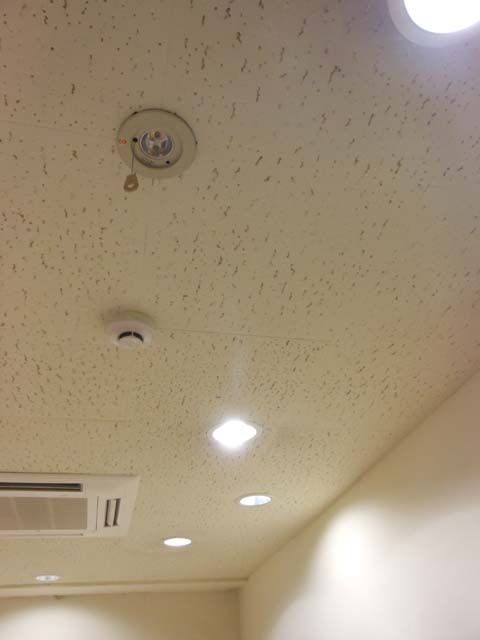
Image resolution: width=480 pixels, height=640 pixels. I want to click on white ceiling, so click(x=377, y=322).